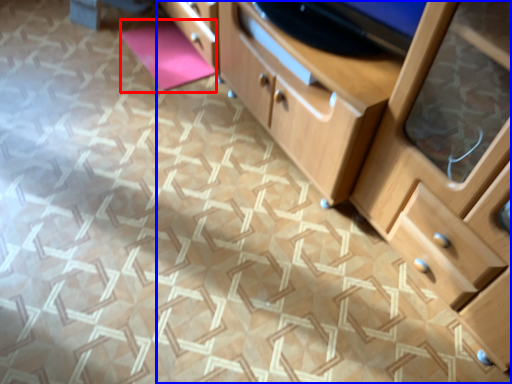
Question: Which object is further to the camera taking this photo, yoga mat (highlighted by a red box) or chest of drawers (highlighted by a blue box)?

Choices:
 (A) yoga mat
 (B) chest of drawers

Answer: (A)